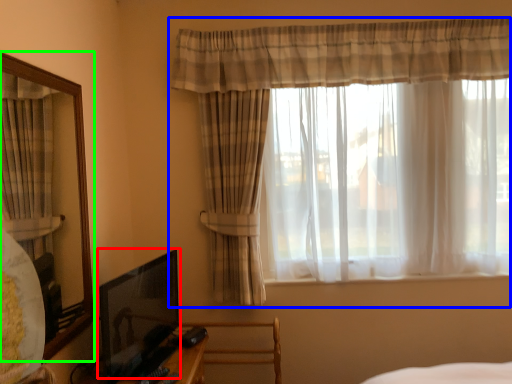
Question: Which object is positioned closest to picture frame (highlighted by a red box)? Select from curtain (highlighted by a blue box) and mirror (highlighted by a green box).

Choices:
 (A) curtain
 (B) mirror

Answer: (B)